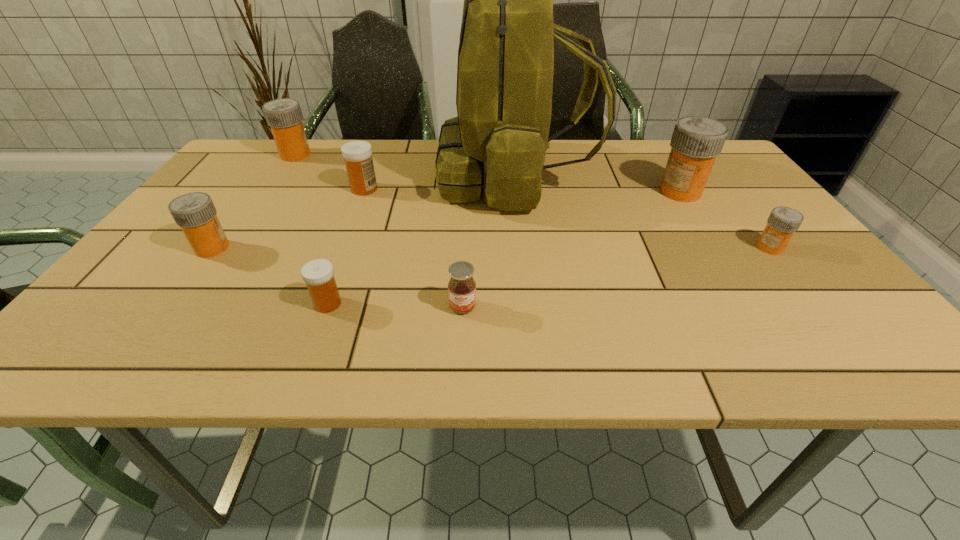
Identify the location of the smaller white medicine. The height and width of the screenshot is (540, 960). (318, 274).

Identify the location of the nearest medicine. This screenshot has width=960, height=540. (318, 274).

Locate an element on the screen. This screenshot has width=960, height=540. vacant area situated 0.370m on the front-facing side of the backpack is located at coordinates (304, 177).

Locate an element on the screen. This screenshot has width=960, height=540. vacant area located on the front-facing side of the backpack is located at coordinates (308, 177).

What are the coordinates of `free space located 0.350m on the front-facing side of the backpack` in the screenshot? It's located at (311, 177).

Where is `vacant area situated 0.310m on the label side of the fifth medicine from left to right`? vacant area situated 0.310m on the label side of the fifth medicine from left to right is located at coordinates (540, 192).

Find the location of a particular element. This screenshot has height=540, width=960. free location located on the label side of the fifth medicine from left to right is located at coordinates (628, 192).

Locate an element on the screen. free space located 0.280m on the label side of the fifth medicine from left to right is located at coordinates (552, 192).

What are the coordinates of `free location located 0.120m on the label side of the sixth shortest object` in the screenshot? It's located at (351, 155).

This screenshot has width=960, height=540. Find the location of `free space located on the label side of the second smallest orange medicine`. free space located on the label side of the second smallest orange medicine is located at coordinates (364, 248).